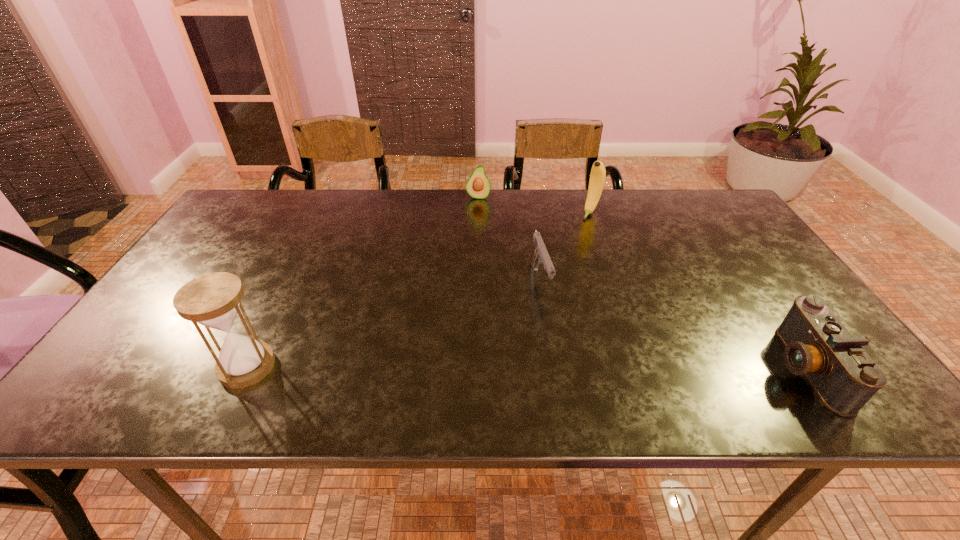
In order to click on free region located 0.080m on the lens of the camera in this screenshot , I will do `click(740, 368)`.

What are the coordinates of `vacant space located 0.120m on the lens of the camera` in the screenshot? It's located at (722, 368).

Image resolution: width=960 pixels, height=540 pixels. What are the coordinates of `free space located 0.180m on the lens of the camera` in the screenshot? It's located at (694, 368).

Find the location of a particular element. vacant area located 0.060m at the barrel of the third nearest object is located at coordinates (551, 322).

The height and width of the screenshot is (540, 960). I want to click on free space located at the barrel of the third nearest object, so click(x=552, y=325).

Locate an element on the screen. This screenshot has height=540, width=960. vacant space located 0.100m at the barrel of the third nearest object is located at coordinates (556, 335).

I want to click on free space located from the stem of the fourth nearest object, so click(556, 266).

You are a GUI agent. You are given a task and a screenshot of the screen. Output one action in this format:
    pyautogui.click(x=<x>, y=<y>)
    Task: Click on the vacant position located 0.110m from the stem of the fourth nearest object
    This screenshot has width=960, height=540.
    Given the screenshot: What is the action you would take?
    pyautogui.click(x=575, y=238)

I want to click on free region located 0.320m from the stem of the fourth nearest object, so click(x=547, y=279).

Find the location of a particular element. This screenshot has width=960, height=540. vacant area situated 0.370m on the cut side of the fourth object from right to left is located at coordinates (469, 274).